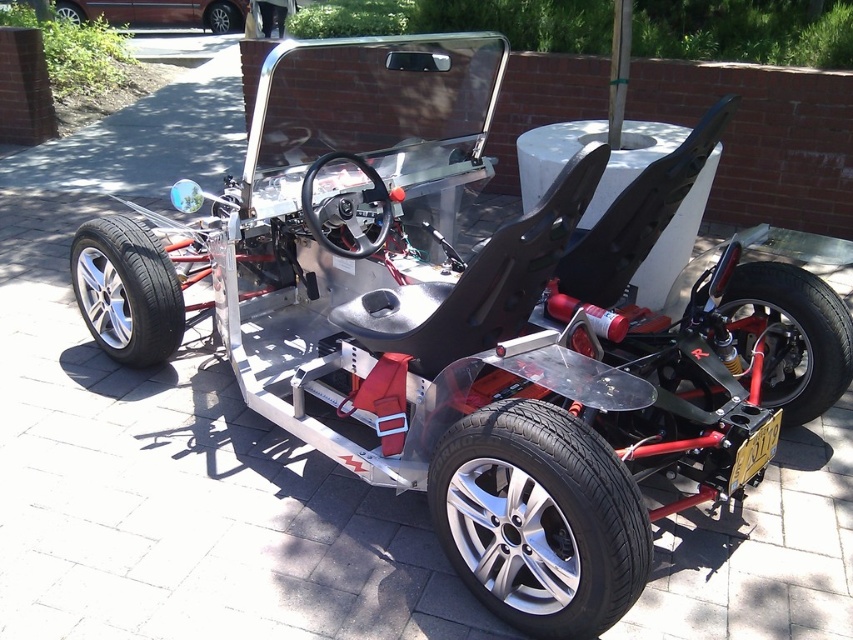
In the scene shown: Can you confirm if metallic maroon van at upper left is bigger than black matte steering wheel at center?

Correct, metallic maroon van at upper left is larger in size than black matte steering wheel at center.

Where is `metallic maroon van at upper left`? metallic maroon van at upper left is located at coordinates (158, 12).

The height and width of the screenshot is (640, 853). Identify the location of metallic maroon van at upper left. (158, 12).

Is point (813, 292) farther from viewer compared to point (90, 323)?

No, (813, 292) is closer to viewer.

Find the location of a particular element. black rubber tire at lower right is located at coordinates (791, 337).

Measure the distance from black rubber tire at lower right to metallic maroon van at upper left.

black rubber tire at lower right is 9.87 meters from metallic maroon van at upper left.

This screenshot has height=640, width=853. What do you see at coordinates (791, 337) in the screenshot? I see `black rubber tire at lower right` at bounding box center [791, 337].

You are a GUI agent. You are given a task and a screenshot of the screen. Output one action in this format:
    pyautogui.click(x=<x>, y=<y>)
    Task: Click on the black rubber tire at lower right
    The height and width of the screenshot is (640, 853).
    Given the screenshot: What is the action you would take?
    pyautogui.click(x=791, y=337)